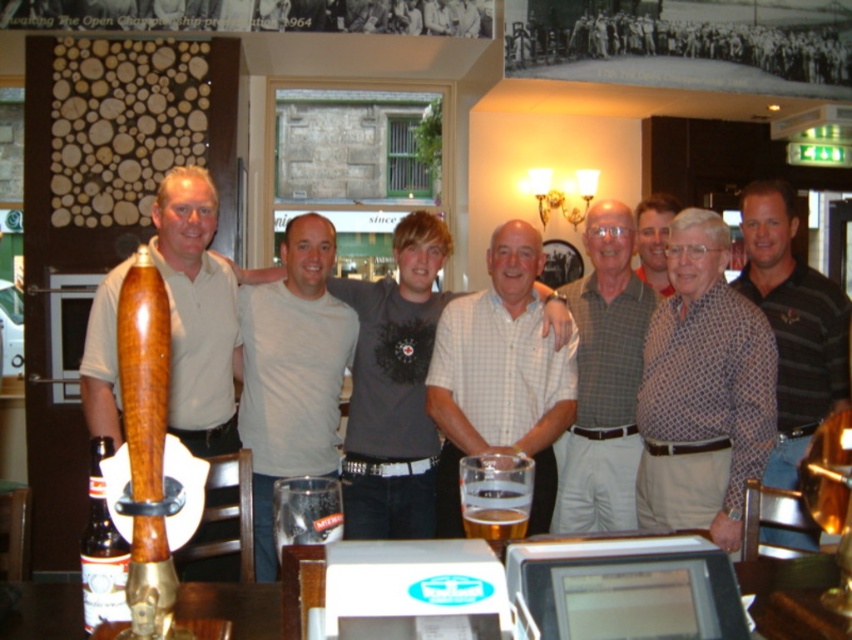
Does wooden tap handle at center have a greater height compared to matte red shirt at center?

Yes, wooden tap handle at center is taller than matte red shirt at center.

Can you confirm if wooden tap handle at center is smaller than matte red shirt at center?

Incorrect, wooden tap handle at center is not smaller in size than matte red shirt at center.

Is point (193, 237) behind point (646, 264)?

No.

You are a GUI agent. You are given a task and a screenshot of the screen. Output one action in this format:
    pyautogui.click(x=<x>, y=<y>)
    Task: Click on the wooden tap handle at center
    
    Given the screenshot: What is the action you would take?
    pyautogui.click(x=197, y=314)

Does point (320, 284) lie in front of point (611, 458)?

No, it is not.

The width and height of the screenshot is (852, 640). In order to click on white cotton shirt at center in this screenshot , I will do `click(291, 371)`.

Locate an element on the screen. The width and height of the screenshot is (852, 640). white cotton shirt at center is located at coordinates (291, 371).

Is checkered shirt at center to the left of white cotton shirt at center from the viewer's perspective?

No, checkered shirt at center is not to the left of white cotton shirt at center.

Is checkered shirt at center bigger than white cotton shirt at center?

No.

The image size is (852, 640). What do you see at coordinates (499, 376) in the screenshot?
I see `checkered shirt at center` at bounding box center [499, 376].

Locate an element on the screen. The height and width of the screenshot is (640, 852). checkered shirt at center is located at coordinates (499, 376).